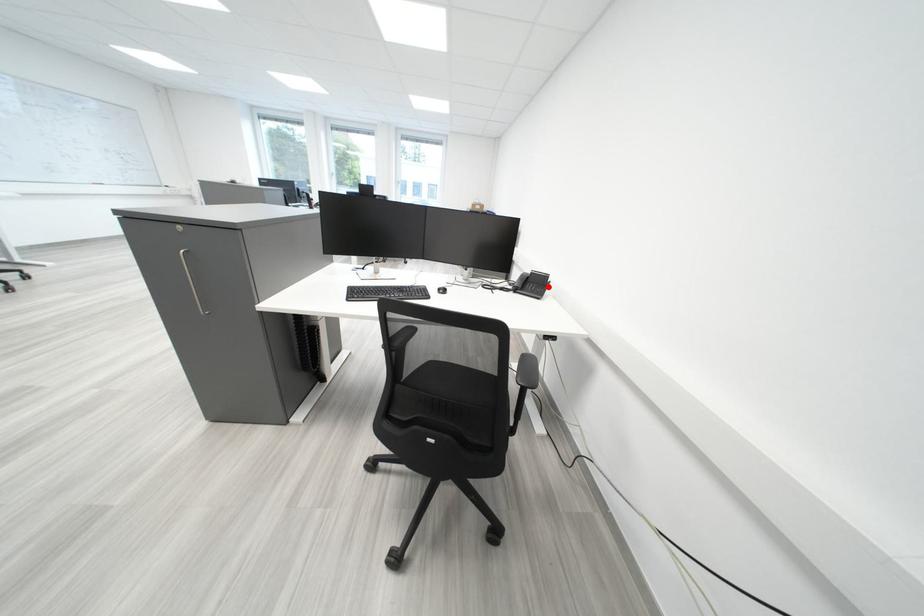
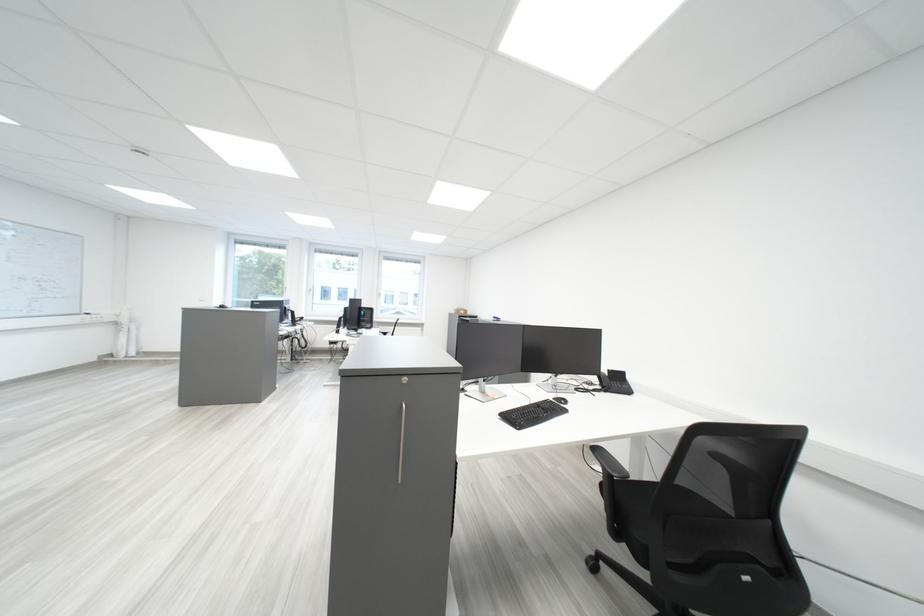
Question: A red point is marked in image1. In image2, is the corresponding 3D point closer to the camera or farther? Reply with the corresponding letter.

Choices:
 (A) The corresponding 3D point is closer.
 (B) The corresponding 3D point is farther.

Answer: (B)